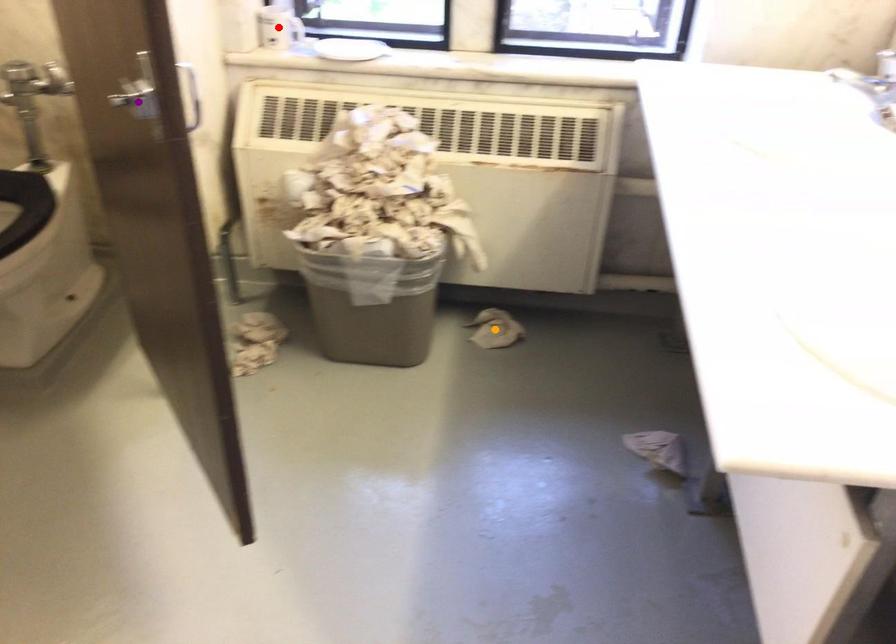
Order these from farthest to nearest:
orange point, red point, purple point

orange point
red point
purple point